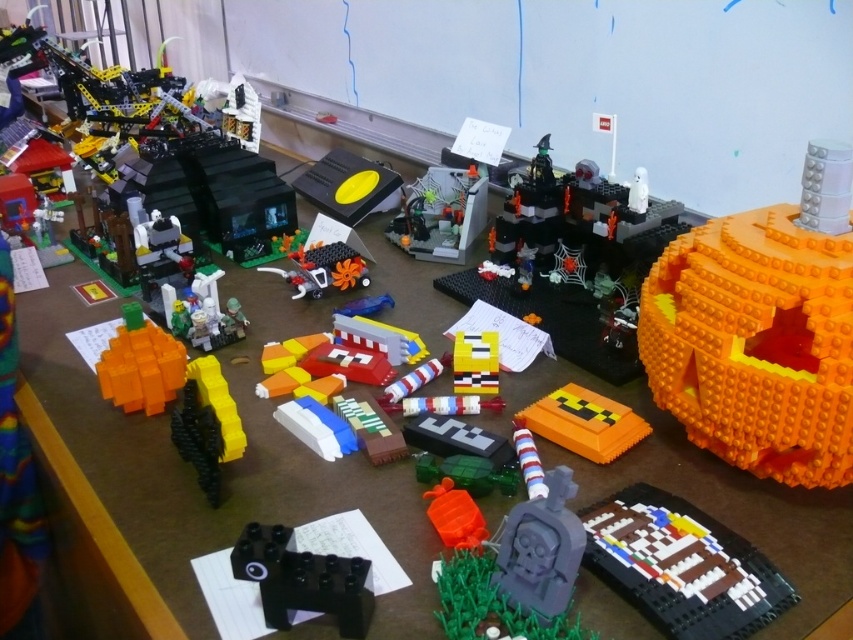
Between point (701, 518) and point (467, 348), which one is positioned in front?

Point (701, 518)

Who is more distant from viewer, (670, 504) or (495, 340)?

The point (495, 340) is behind.

In order to click on brown matte house at lower right in this screenshot , I will do `click(682, 564)`.

Which is above, brown matte house at lower right or smooth gray gravestone at center?

smooth gray gravestone at center is higher up.

Measure the distance between brown matte house at lower right and camera.

25.49 inches

Find the location of a particular element. This screenshot has width=853, height=640. brown matte house at lower right is located at coordinates (682, 564).

Locate an element on the screen. This screenshot has width=853, height=640. brown matte house at lower right is located at coordinates (682, 564).

Consider the image. Is orange matte pumpkin at center closer to the viewer compared to yellow matte brick at center?

Yes.

Can you confirm if orange matte pumpkin at center is wider than yellow matte brick at center?

Yes.

Is point (548, 403) farther from viewer compared to point (462, 368)?

No, (548, 403) is in front of (462, 368).

Find the location of a particular element. This screenshot has width=853, height=640. orange matte pumpkin at center is located at coordinates (584, 422).